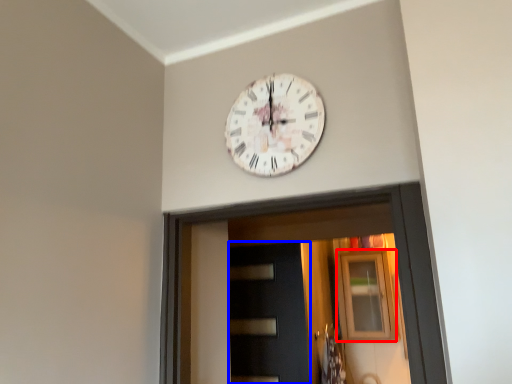
Question: Among these objects, which one is nearest to the camera, window (highlighted by a red box) or door (highlighted by a blue box)?

Choices:
 (A) window
 (B) door

Answer: (B)